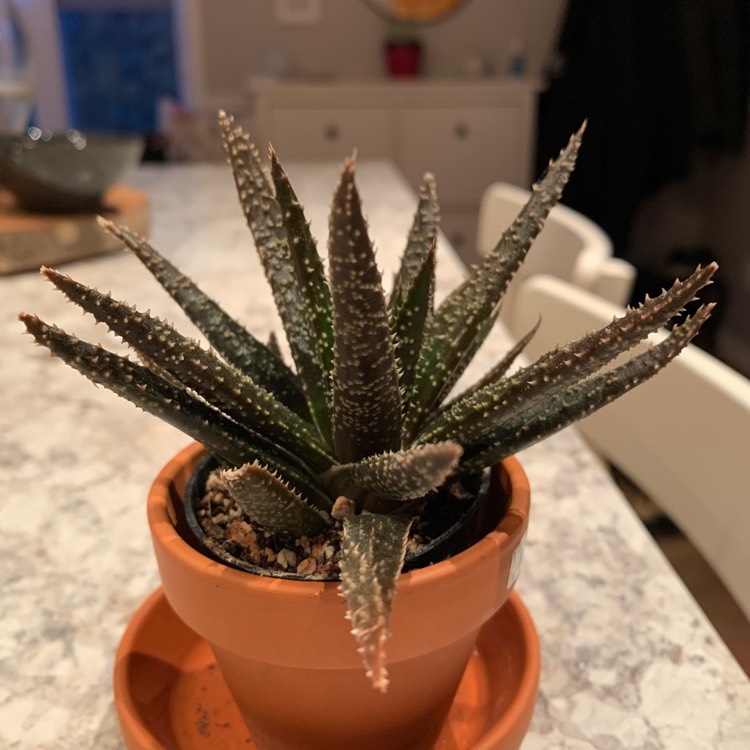
Image resolution: width=750 pixels, height=750 pixels. I want to click on pot, so click(288, 655).